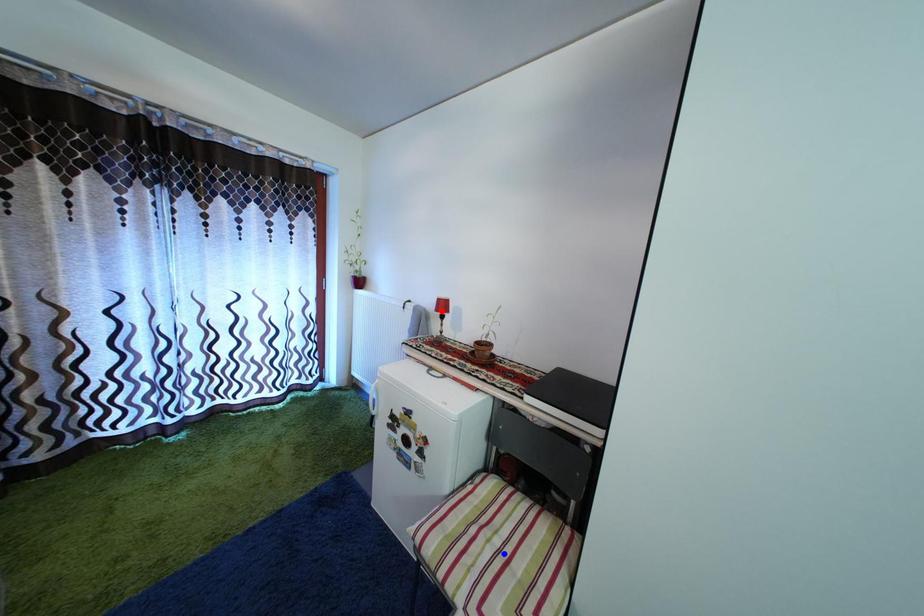
Question: In the image, two points are highlighted. Which point is nearer to the camera? Reply with the corresponding letter.

Choices:
 (A) blue point
 (B) red point

Answer: (A)